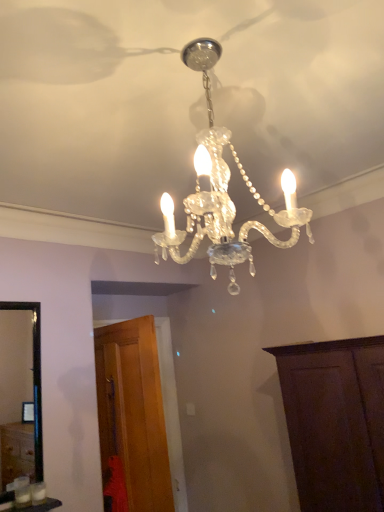
Question: Is wooden door at lower left, the first cabinetry viewed from the left, positioned before clear crystal chandelier at center?

Choices:
 (A) yes
 (B) no

Answer: (B)

Question: Does wooden door at lower left, the first cabinetry viewed from the left, have a larger size compared to clear crystal chandelier at center?

Choices:
 (A) yes
 (B) no

Answer: (A)

Question: Is wooden door at lower left, acting as the 2th cabinetry starting from the right, turned away from clear crystal chandelier at center?

Choices:
 (A) yes
 (B) no

Answer: (B)

Question: Is wooden door at lower left, acting as the 2th cabinetry starting from the right, oriented towards clear crystal chandelier at center?

Choices:
 (A) no
 (B) yes

Answer: (A)

Question: Is wooden door at lower left, the first cabinetry viewed from the left, far away from clear crystal chandelier at center?

Choices:
 (A) no
 (B) yes

Answer: (B)

Question: Can you confirm if wooden door at lower left, acting as the 2th cabinetry starting from the right, is wider than clear crystal chandelier at center?

Choices:
 (A) no
 (B) yes

Answer: (A)

Question: Is dark wood cabinet at lower right, which is counted as the first cabinetry, starting from the right, thinner than clear crystal chandelier at center?

Choices:
 (A) yes
 (B) no

Answer: (B)

Question: Can you confirm if dark wood cabinet at lower right, which is counted as the first cabinetry, starting from the right, is wider than clear crystal chandelier at center?

Choices:
 (A) no
 (B) yes

Answer: (B)

Question: Is dark wood cabinet at lower right, the 2th cabinetry when ordered from left to right, smaller than clear crystal chandelier at center?

Choices:
 (A) yes
 (B) no

Answer: (B)

Question: Could you tell me if dark wood cabinet at lower right, the 2th cabinetry when ordered from left to right, is facing clear crystal chandelier at center?

Choices:
 (A) yes
 (B) no

Answer: (A)

Question: Considering the relative sizes of dark wood cabinet at lower right, the 2th cabinetry when ordered from left to right, and clear crystal chandelier at center in the image provided, is dark wood cabinet at lower right, the 2th cabinetry when ordered from left to right, taller than clear crystal chandelier at center?

Choices:
 (A) yes
 (B) no

Answer: (A)

Question: From a real-world perspective, is dark wood cabinet at lower right, the 2th cabinetry when ordered from left to right, on clear crystal chandelier at center?

Choices:
 (A) yes
 (B) no

Answer: (B)

Question: From a real-world perspective, is clear crystal chandelier at center on wooden door at lower left, acting as the 2th cabinetry starting from the right?

Choices:
 (A) yes
 (B) no

Answer: (A)